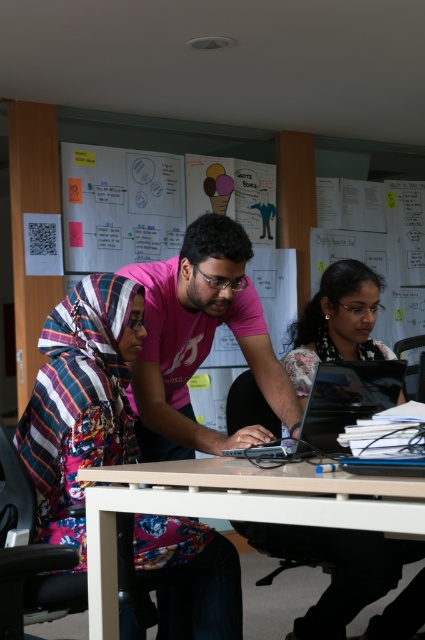
From the picture: You are a photographer setting up a shot of the workspace. You need to focus on both the patterned fabric hijab at center and the glossy black laptop at center. Which object should you adjust your camera focus to first to ensure it is in the foreground?

The patterned fabric hijab at center is further to the viewer than the glossy black laptop at center, so you should focus on the patterned fabric hijab at center first as it is closer to the camera.

You are a worker who needs to place a new document on the white glossy table at center without covering the matte black laptop at center. Is this possible?

The matte black laptop at center is below the white glossy table at center, so it is already positioned under the table. Therefore, placing the document on the table won wait interfere with the laptop since the laptop is underneath.

From the picture: You are standing at point (x=337, y=474) and want to walk to the door located at point (x=303, y=310). However, there is an obstacle in your path. Which direction should you move to avoid the obstacle and reach the door?

Since point (x=303, y=310) is behind point (x=337, y=474), you should move backward towards the direction of the door located at point (x=303, y=310) to avoid the obstacle and reach it.